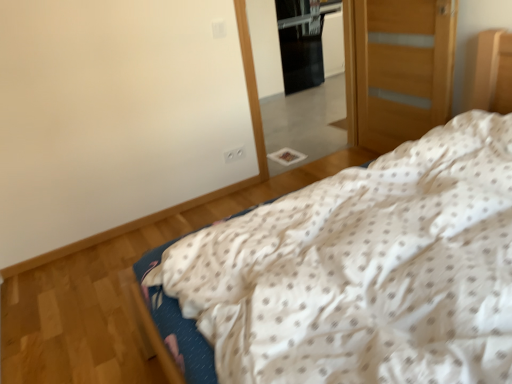
Question: Considering their positions, is clear glass mirror at center located in front of or behind wooden door at right?

Choices:
 (A) front
 (B) behind

Answer: (B)

Question: From the image's perspective, relative to wooden door at right, is clear glass mirror at center above or below?

Choices:
 (A) above
 (B) below

Answer: (A)

Question: Based on their relative distances, which object is farther from the white dotted fabric at center?

Choices:
 (A) wooden door at right
 (B) black glass screen door at upper center
 (C) clear glass mirror at center

Answer: (B)

Question: Which of these objects is positioned closest to the clear glass mirror at center?

Choices:
 (A) white dotted fabric at center
 (B) black glass screen door at upper center
 (C) wooden door at right

Answer: (B)